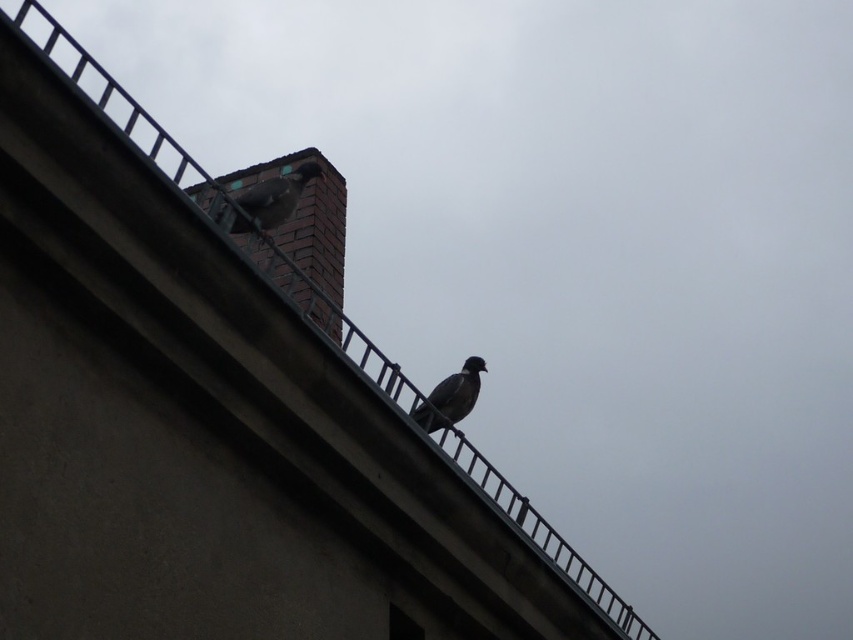
Is point (260, 193) behind point (463, 412)?

No, (260, 193) is closer to viewer.

Is point (256, 186) positioned after point (425, 412)?

No, (256, 186) is in front of (425, 412).

In order to click on gray matte pigeon at upper center in this screenshot , I will do `click(276, 195)`.